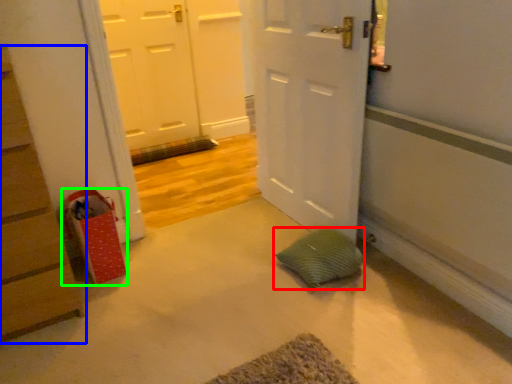
Question: Considering the real-world distances, which object is closest to pillow (highlighted by a red box)? chest of drawers (highlighted by a blue box) or shopping bag (highlighted by a green box).

Choices:
 (A) chest of drawers
 (B) shopping bag

Answer: (B)